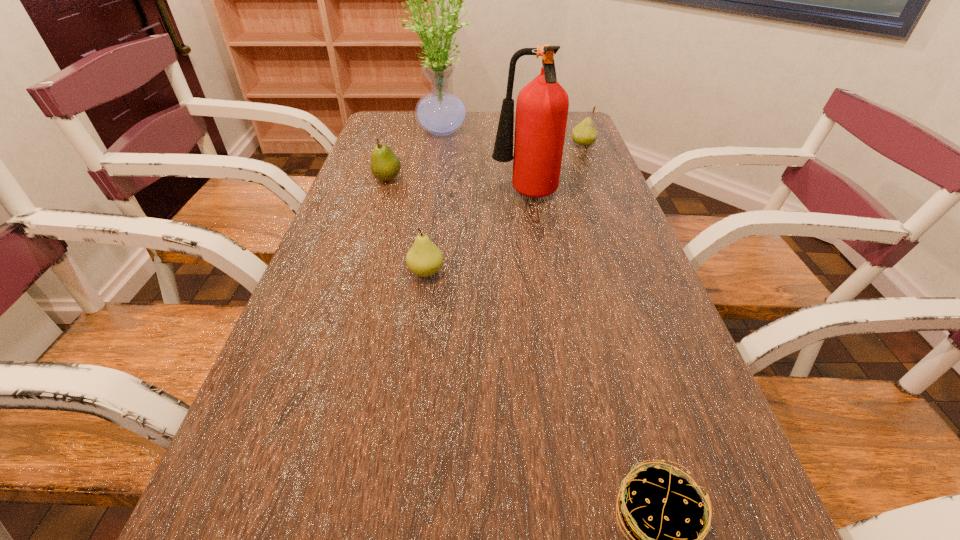
This screenshot has height=540, width=960. Identify the location of vacant space located 0.350m at the nozzle of the fire extinguisher. (364, 196).

Find the location of `vacant space situated on the left of the farthest pear`. vacant space situated on the left of the farthest pear is located at coordinates (543, 144).

Locate an element on the screen. The image size is (960, 540). free space located 0.300m on the right of the second farthest pear is located at coordinates (505, 179).

Locate an element on the screen. The image size is (960, 540). free space located 0.290m on the back of the nearest pear is located at coordinates (437, 193).

Locate an element on the screen. flower arrangement located at the far edge is located at coordinates (440, 112).

Where is `pear that is at the far edge`? pear that is at the far edge is located at coordinates (584, 134).

Image resolution: width=960 pixels, height=540 pixels. I want to click on flower arrangement that is positioned at the left edge, so click(440, 112).

Identify the location of pear positioned at the left edge. This screenshot has width=960, height=540. (385, 165).

At what (x,y) coordinates should I click in order to perform the action: click on object located in the right edge section of the desktop. Please return your answer as a coordinate pair (x, y). The width and height of the screenshot is (960, 540). Looking at the image, I should click on (584, 134).

Image resolution: width=960 pixels, height=540 pixels. Find the location of `object at the far left corner`. object at the far left corner is located at coordinates (440, 112).